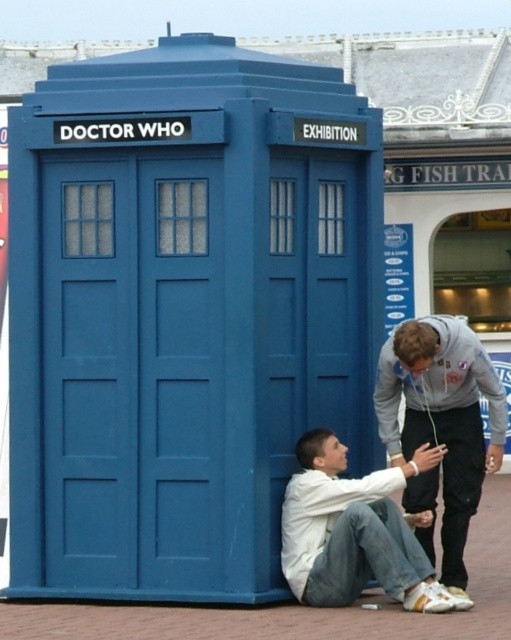
Question: Can you confirm if gray hoodie at lower right is wider than white matte shirt at lower center?

Choices:
 (A) no
 (B) yes

Answer: (A)

Question: Does gray hoodie at lower right appear on the right side of white matte shirt at lower center?

Choices:
 (A) no
 (B) yes

Answer: (B)

Question: Which point is farther from the camera taking this photo?

Choices:
 (A) (366, 493)
 (B) (385, 444)

Answer: (B)

Question: Is the position of gray hoodie at lower right more distant than that of white matte shirt at lower center?

Choices:
 (A) yes
 (B) no

Answer: (A)